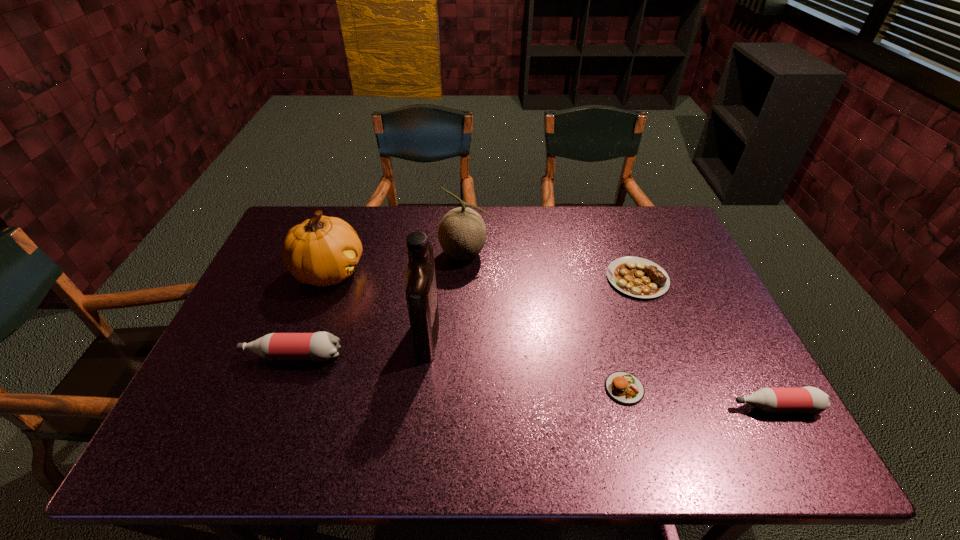
Identify the location of the taller bottle. The height and width of the screenshot is (540, 960). (321, 346).

Where is `the farther bottle`? the farther bottle is located at coordinates (x=321, y=346).

You are a GUI agent. You are given a task and a screenshot of the screen. Output one action in this format:
    pyautogui.click(x=<x>, y=<y>)
    Task: Click on the nearer bottle
    The height and width of the screenshot is (540, 960).
    Given the screenshot: What is the action you would take?
    pyautogui.click(x=808, y=399)

Identify the location of the rightmost object. (808, 399).

Find the location of a particular element. Image resolution: width=960 pixels, height=540 pixels. cantaloup is located at coordinates (462, 232).

Where is `steak`? steak is located at coordinates (637, 277).

Locate an element on the screen. Image resolution: width=960 pixels, height=540 pixels. liquor is located at coordinates (421, 292).

Locate an element on the screen. Image resolution: width=960 pixels, height=540 pixels. pumpkin is located at coordinates (322, 251).

Find the location of `patty`. patty is located at coordinates (623, 387).

Locate an element on the screen. free point located with the cap open on the left bottle is located at coordinates (215, 356).